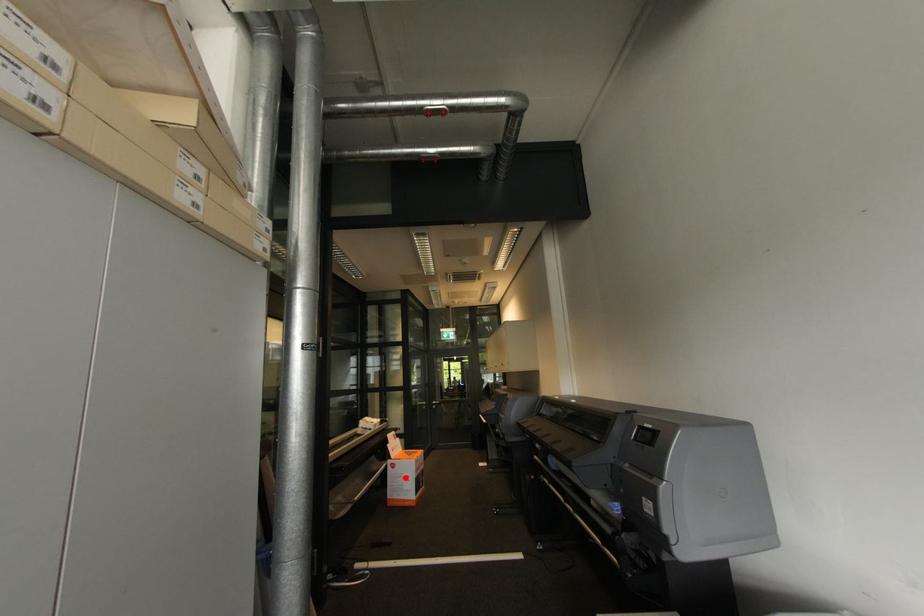
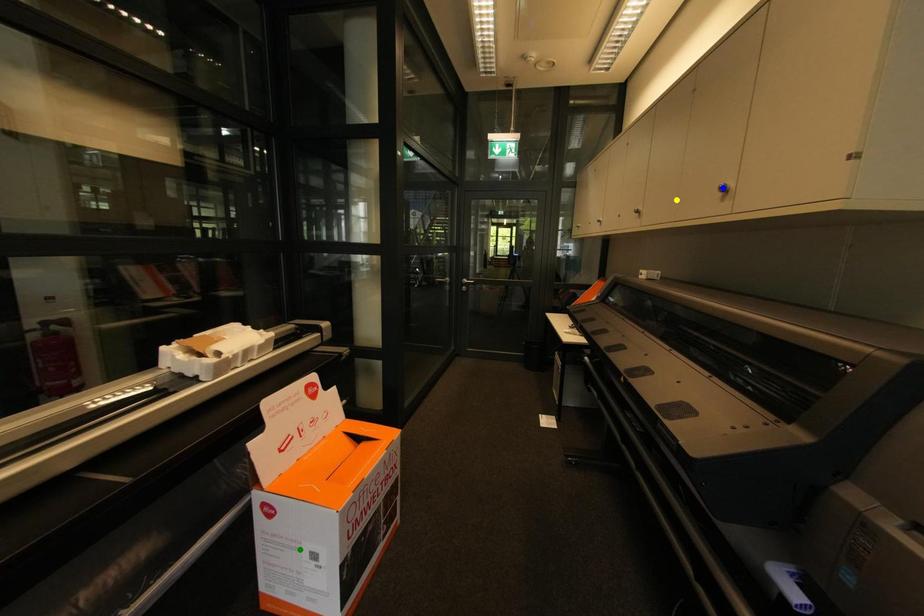
Question: I am providing you with two images of the same scene from different viewpoints. A red point is marked on the first image. You are given multiple points on the second image. Which spot in image 2 lines up with the point in image 1?

Choices:
 (A) yellow point
 (B) green point
 (C) blue point

Answer: (B)